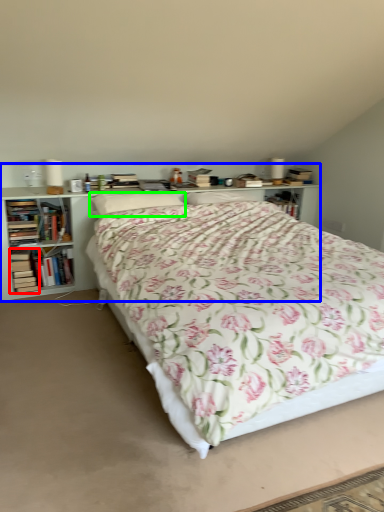
Question: Considering the real-world distances, which object is closest to book (highlighted by a red box)? bookcase (highlighted by a blue box) or pillow (highlighted by a green box).

Choices:
 (A) bookcase
 (B) pillow

Answer: (A)